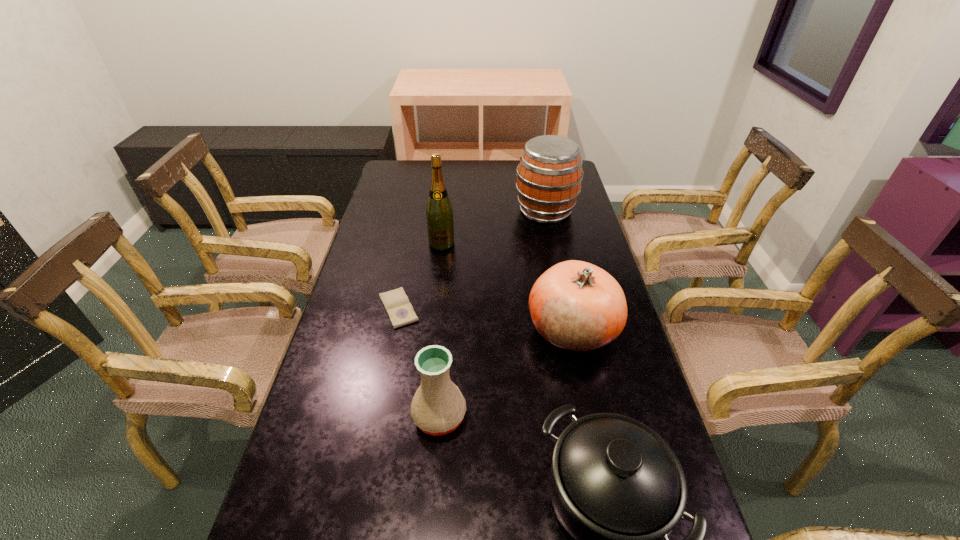
Find the location of a particular element. free space located 0.270m on the back of the diary is located at coordinates (412, 238).

Image resolution: width=960 pixels, height=540 pixels. I want to click on object located at the left edge, so click(400, 311).

Where is `cider that is at the right edge`? cider that is at the right edge is located at coordinates (549, 175).

The height and width of the screenshot is (540, 960). I want to click on pumpkin present at the right edge, so click(x=576, y=306).

In the image, there is a desktop. What are the coordinates of `free region at the far edge` in the screenshot? It's located at (498, 182).

You are a GUI agent. You are given a task and a screenshot of the screen. Output one action in this format:
    pyautogui.click(x=<x>, y=<y>)
    Task: Click on the free space at the left edge of the desktop
    
    Given the screenshot: What is the action you would take?
    point(382,190)

In the image, there is a desktop. Identify the location of blank space at the right edge. The height and width of the screenshot is (540, 960). (576, 248).

Find the location of a particular element. empty location between the second farthest object and the pottery is located at coordinates (441, 330).

At what (x,y) coordinates should I click in order to perform the action: click on unoccupied area between the fifth nearest object and the pumpkin. Please return your answer as a coordinate pair (x, y). Looking at the image, I should click on (507, 286).

Image resolution: width=960 pixels, height=540 pixels. In order to click on vacant point located between the shortest object and the pumpkin in this screenshot , I will do `click(485, 319)`.